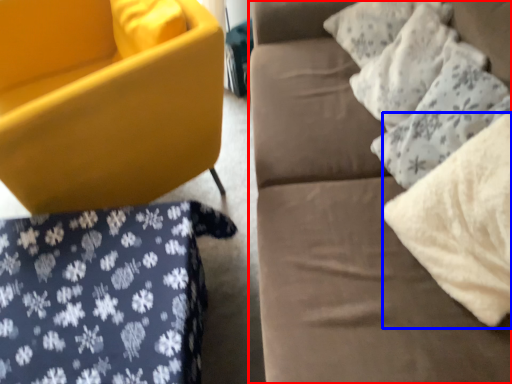
Question: Which object is further to the camera taking this photo, studio couch (highlighted by a red box) or material (highlighted by a blue box)?

Choices:
 (A) studio couch
 (B) material

Answer: (B)